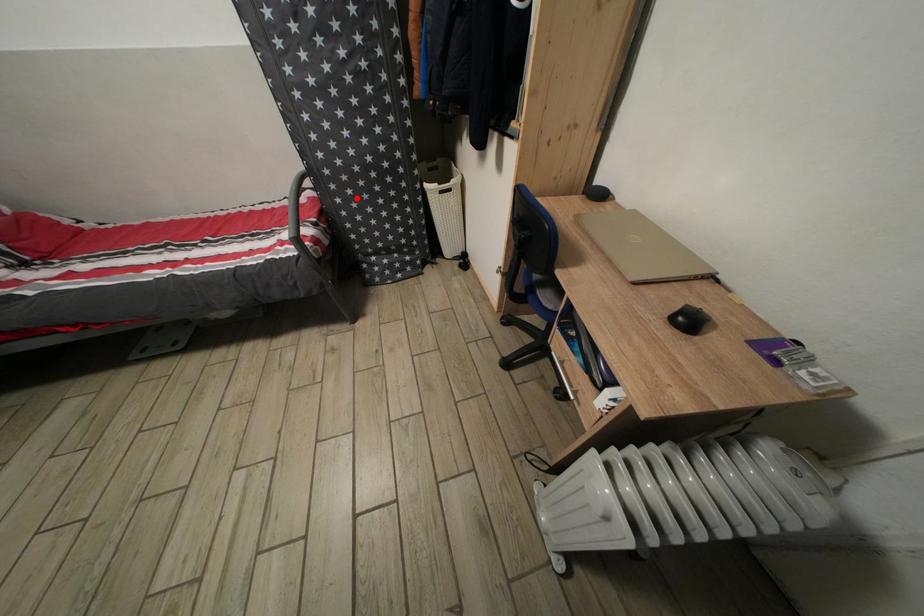
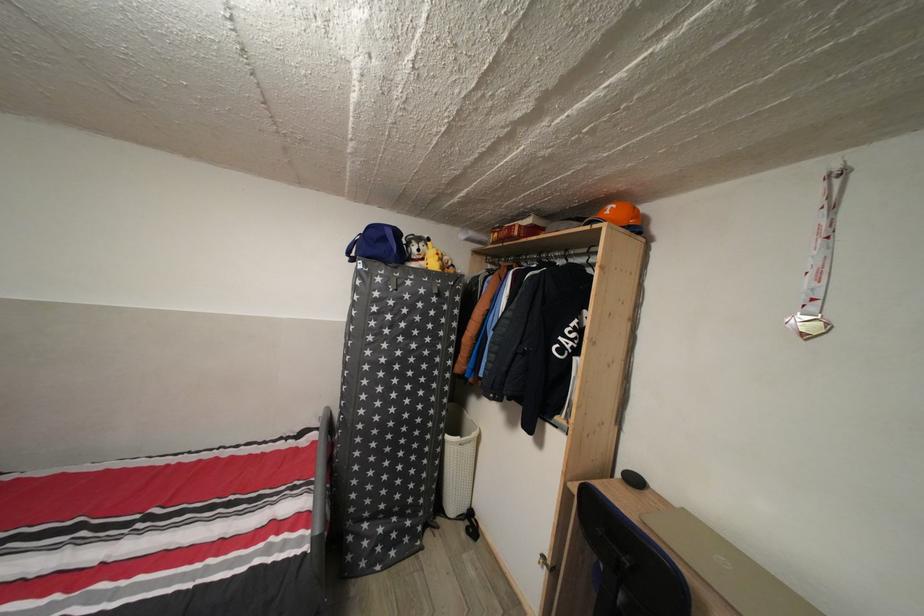
Find the pixel in the second image that matches the highlighted location in the first image.

(380, 451)